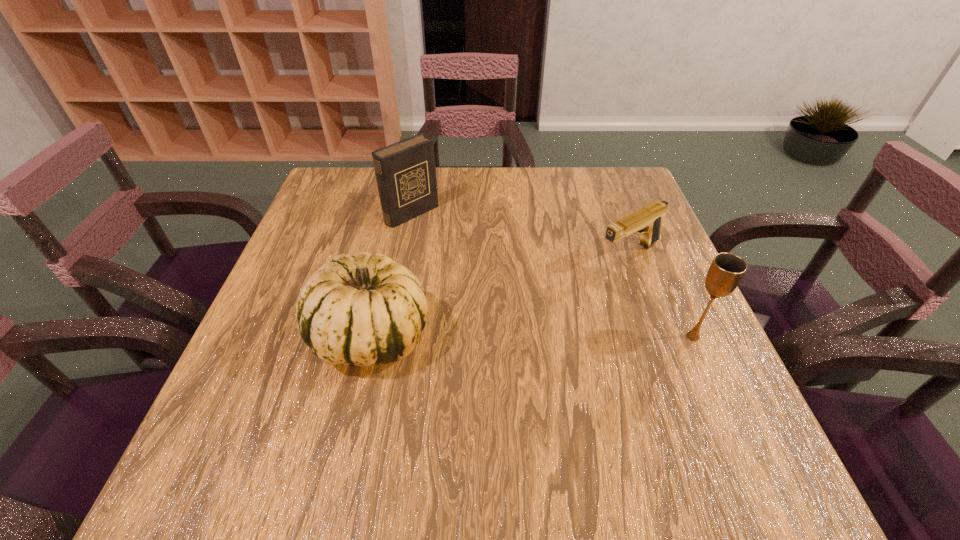
Identify the location of free space on the desktop that is between the gourd and the chalice and is positioned on the front cover of the farthest object. (572, 336).

In order to click on free space on the desktop that is between the gourd and the chalice and is positioned at the barrel of the third nearest object in this screenshot , I will do `click(487, 336)`.